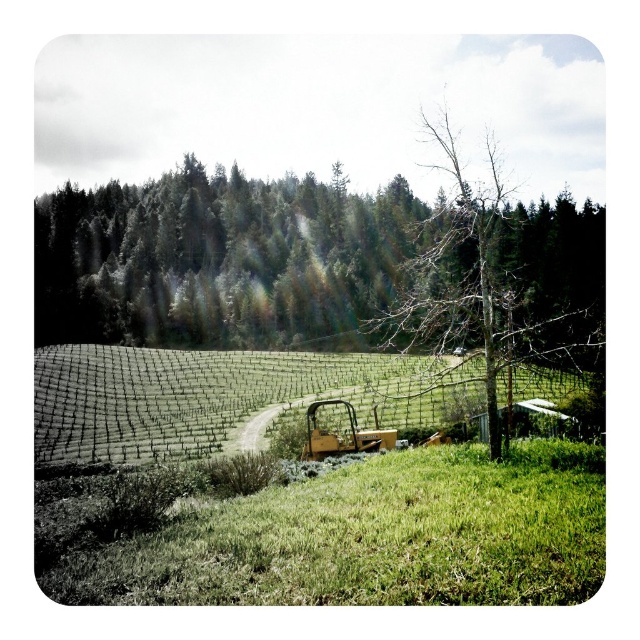
Which is above, green leafy tree at upper center or green netting at center?

green leafy tree at upper center is higher up.

Is green leafy tree at upper center bigger than green netting at center?

Indeed, green leafy tree at upper center has a larger size compared to green netting at center.

Find the location of a particular element. This screenshot has height=640, width=640. green leafy tree at upper center is located at coordinates (220, 259).

The width and height of the screenshot is (640, 640). Identify the location of green leafy tree at upper center. (220, 259).

Which of these two, green netting at center or bare wood tree at center, stands taller?

Standing taller between the two is bare wood tree at center.

Can you confirm if green netting at center is taller than bare wood tree at center?

In fact, green netting at center may be shorter than bare wood tree at center.

Which is in front, point (518, 384) or point (520, 362)?

Point (520, 362) is more forward.

The height and width of the screenshot is (640, 640). Identify the location of green netting at center. (221, 396).

Does green grass at lower center appear over green netting at center?

No, green grass at lower center is not above green netting at center.

In the scene shown: Is green grass at lower center positioned before green netting at center?

Yes.

You are a GUI agent. You are given a task and a screenshot of the screen. Output one action in this format:
    pyautogui.click(x=<x>, y=<y>)
    Task: Click on the green grass at lower center
    The image size is (640, 640).
    Given the screenshot: What is the action you would take?
    pyautogui.click(x=372, y=538)

This screenshot has height=640, width=640. Identify the location of green grass at lower center. (x=372, y=538).